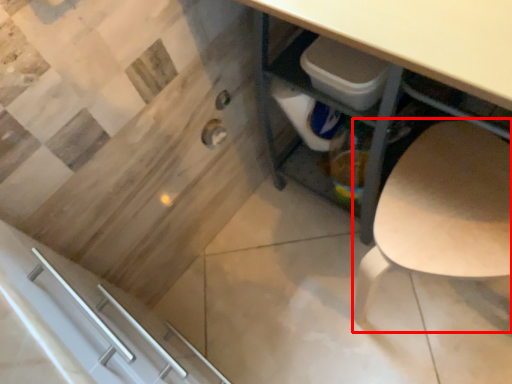
Question: Where is chair (annotated by the red box) located in relation to desk in the image?

Choices:
 (A) right
 (B) left

Answer: (A)